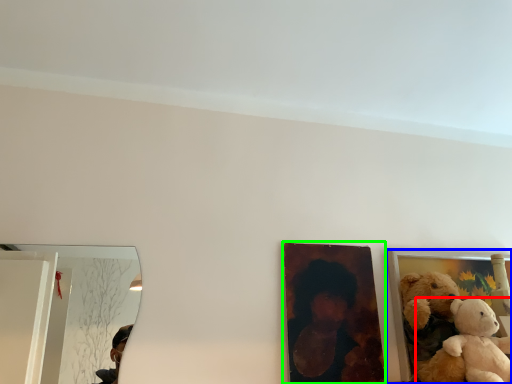
Question: Considering the real-world distances, which object is farthest from teddy bear (highlighted by a red box)? picture frame (highlighted by a blue box) or picture frame (highlighted by a green box)?

Choices:
 (A) picture frame
 (B) picture frame

Answer: (B)